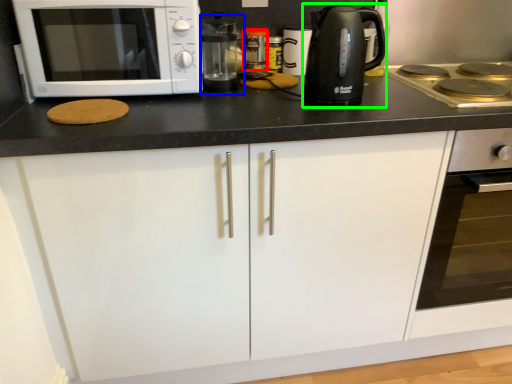
Question: Estimate the real-world distances between objects in this image. Which object is farther from appliance (highlighted by a red box), coffee machine (highlighted by a blue box) or kitchen appliance (highlighted by a green box)?

Choices:
 (A) coffee machine
 (B) kitchen appliance

Answer: (B)